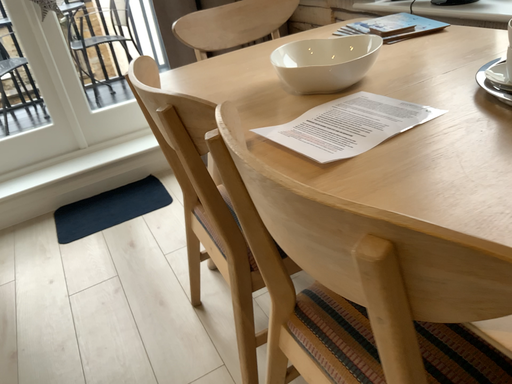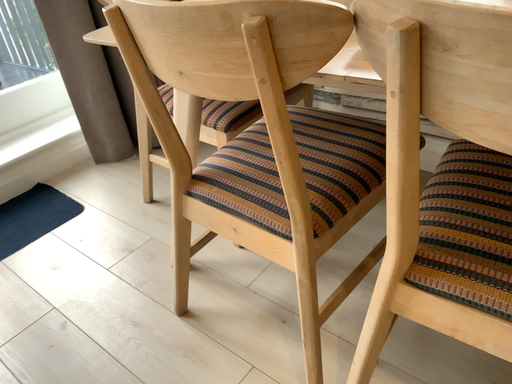
Question: How did the camera likely rotate when shooting the video?

Choices:
 (A) rotated right
 (B) rotated left

Answer: (A)